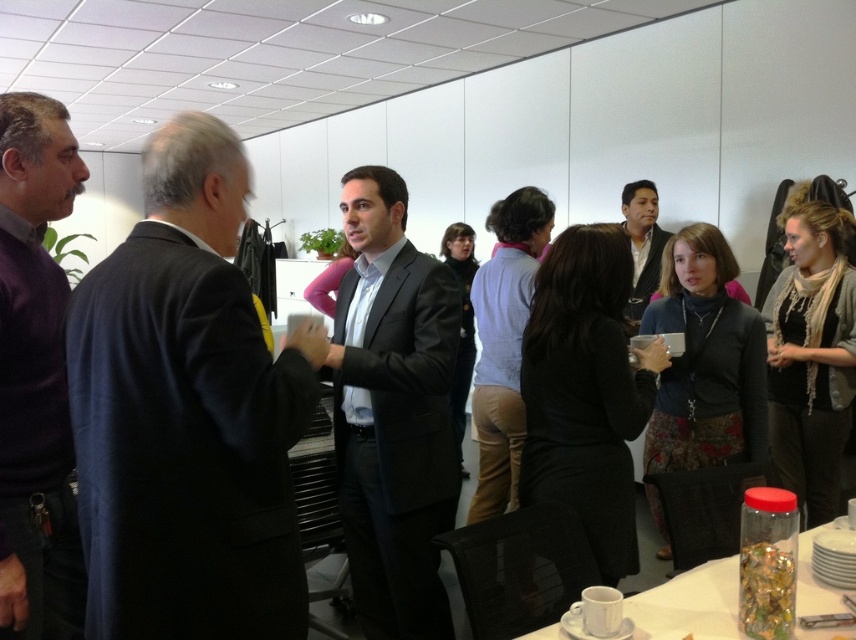
You are organizing a photo shoot and need to position the dark blue suit at left and the purple sweater at left in a row. Based on the scene, which one should you place first if you want the wider one to be on the left side?

The dark blue suit at left should be placed first on the left side since it might be wider than the purple sweater at left according to the description.

What is located at the coordinates point (691, 602)?

A clear plastic jar at lower right is located at point (691, 602).

You are organizing a networking event and need to place a name tag on the table. The name tag is 10 cm wide. There is a clear plastic jar at lower right and a dark brown leather jacket at center. Can the name tag fit between them?

The clear plastic jar at lower right is positioned on the left side of dark brown leather jacket at center. Since the distance between them isn not specified, but the name tag is 10 cm wide, it might fit if there is enough space between the two items. However, without exact measurements, it is uncertain.